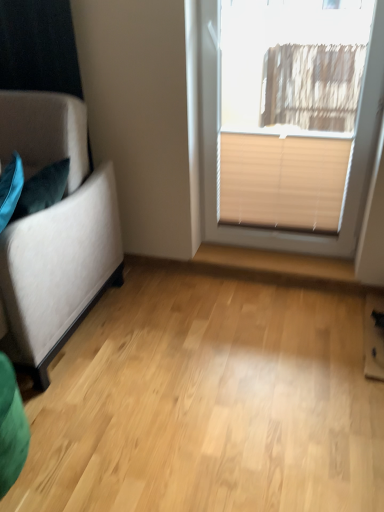
Question: Is beige fabric blind at upper right positioned beyond the bounds of beige blind at upper right?

Choices:
 (A) yes
 (B) no

Answer: (B)

Question: Does beige fabric blind at upper right appear on the left side of beige blind at upper right?

Choices:
 (A) no
 (B) yes

Answer: (A)

Question: Is beige fabric blind at upper right smaller than beige blind at upper right?

Choices:
 (A) no
 (B) yes

Answer: (B)

Question: Considering the relative sizes of beige fabric blind at upper right and beige blind at upper right in the image provided, is beige fabric blind at upper right thinner than beige blind at upper right?

Choices:
 (A) yes
 (B) no

Answer: (A)

Question: Would you say beige fabric blind at upper right contains beige blind at upper right?

Choices:
 (A) no
 (B) yes

Answer: (A)

Question: From a real-world perspective, relative to light wood floor at center, is beige blind at upper right vertically above or below?

Choices:
 (A) below
 (B) above

Answer: (B)

Question: In the image, is beige blind at upper right positioned in front of or behind light wood floor at center?

Choices:
 (A) front
 (B) behind

Answer: (B)

Question: Does point (201, 181) appear closer or farther from the camera than point (173, 425)?

Choices:
 (A) closer
 (B) farther

Answer: (B)

Question: From the image's perspective, is beige blind at upper right located above or below light wood floor at center?

Choices:
 (A) below
 (B) above

Answer: (B)

Question: Based on their sizes in the image, would you say beige fabric blind at upper right is bigger or smaller than light wood floor at center?

Choices:
 (A) big
 (B) small

Answer: (B)

Question: Considering the positions of beige fabric blind at upper right and light wood floor at center in the image, is beige fabric blind at upper right wider or thinner than light wood floor at center?

Choices:
 (A) thin
 (B) wide

Answer: (A)

Question: From a real-world perspective, is beige fabric blind at upper right above or below light wood floor at center?

Choices:
 (A) below
 (B) above

Answer: (B)

Question: Considering the relative positions of beige fabric blind at upper right and light wood floor at center in the image provided, is beige fabric blind at upper right to the left or to the right of light wood floor at center?

Choices:
 (A) left
 (B) right

Answer: (B)

Question: Relative to suede-like beige couch at left, is beige blind at upper right in front or behind?

Choices:
 (A) behind
 (B) front

Answer: (A)

Question: In terms of width, does beige blind at upper right look wider or thinner when compared to suede-like beige couch at left?

Choices:
 (A) wide
 (B) thin

Answer: (B)